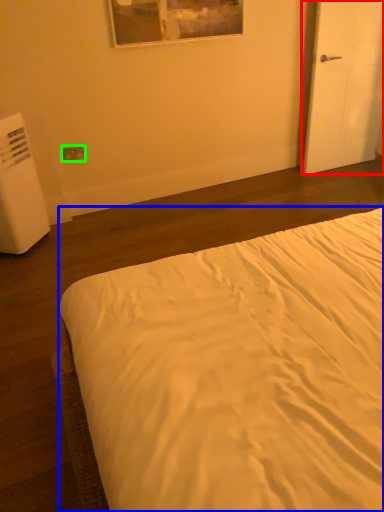
Question: Which is nearer to the door (highlighted by a red box)? bed (highlighted by a blue box) or electric outlet (highlighted by a green box).

Choices:
 (A) bed
 (B) electric outlet

Answer: (B)